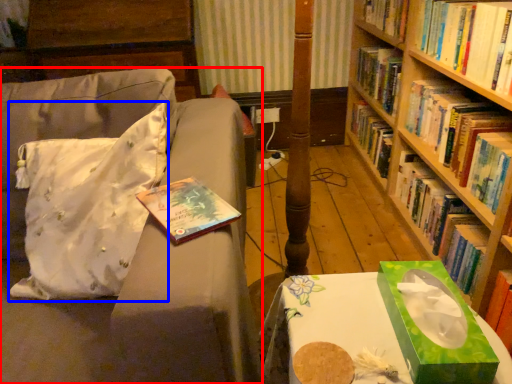
Question: Which point is further to the camera, studio couch (highlighted by a red box) or throw pillow (highlighted by a blue box)?

Choices:
 (A) studio couch
 (B) throw pillow

Answer: (B)